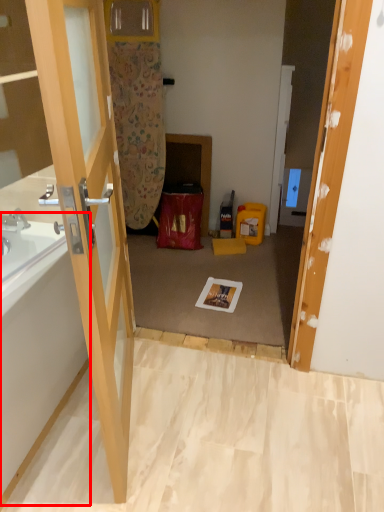
Question: In this image, where is bath (annotated by the red box) located relative to door?

Choices:
 (A) right
 (B) left

Answer: (B)